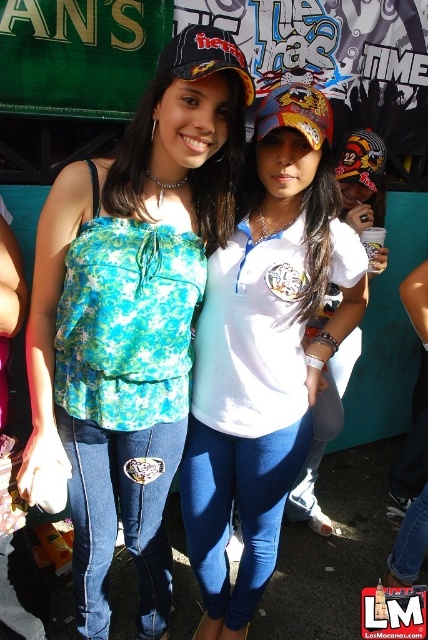
Question: Observing the image, what is the correct spatial positioning of floral fabric top at center in reference to white matte shirt at center?

Choices:
 (A) left
 (B) right

Answer: (A)

Question: Can you confirm if floral fabric top at center is positioned below black matte baseball cap at center?

Choices:
 (A) yes
 (B) no

Answer: (A)

Question: Which object appears closest to the camera in this image?

Choices:
 (A) floral fabric top at center
 (B) white matte shirt at center

Answer: (A)

Question: In this image, where is white matte shirt at center located relative to black matte baseball cap at center?

Choices:
 (A) left
 (B) right

Answer: (B)

Question: Among these points, which one is nearest to the camera?

Choices:
 (A) (181, 420)
 (B) (211, 51)

Answer: (B)

Question: Among these objects, which one is farthest from the camera?

Choices:
 (A) black matte baseball cap at center
 (B) floral fabric top at center
 (C) white matte shirt at center

Answer: (C)